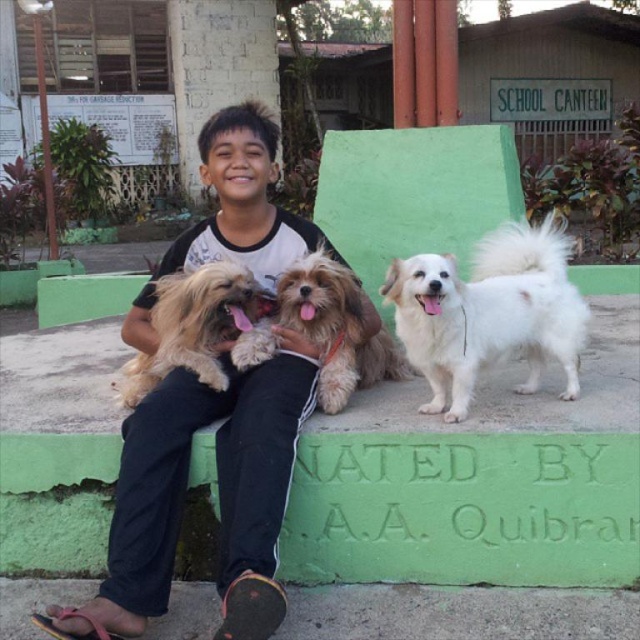
Is black cotton shirt at center positioned at the back of light brown fur at center?

No, it is not.

Does point (275, 385) come closer to viewer compared to point (259, 317)?

Yes, point (275, 385) is closer to viewer.

The image size is (640, 640). Find the location of `black cotton shirt at center`. black cotton shirt at center is located at coordinates (218, 497).

Who is lower down, black cotton shirt at center or fuzzy brown dog at center?

Positioned lower is black cotton shirt at center.

Which is more to the left, black cotton shirt at center or fuzzy brown dog at center?

From the viewer's perspective, black cotton shirt at center appears more on the left side.

Is point (154, 458) closer to viewer compared to point (328, 257)?

Yes, it is in front of point (328, 257).

The height and width of the screenshot is (640, 640). I want to click on black cotton shirt at center, so click(218, 497).

Does white fluffy dog at right appear on the left side of light brown fur at center?

In fact, white fluffy dog at right is to the right of light brown fur at center.

Which is behind, point (532, 257) or point (209, 310)?

Positioned behind is point (532, 257).

The image size is (640, 640). I want to click on white fluffy dog at right, so click(x=490, y=312).